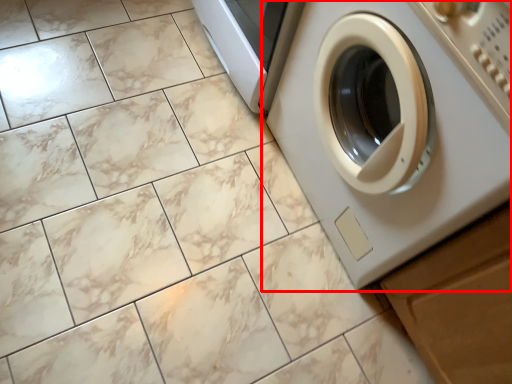
Question: From the image, what is the correct spatial relationship of washing machine (annotated by the red box) in relation to drawer?

Choices:
 (A) left
 (B) right

Answer: (A)